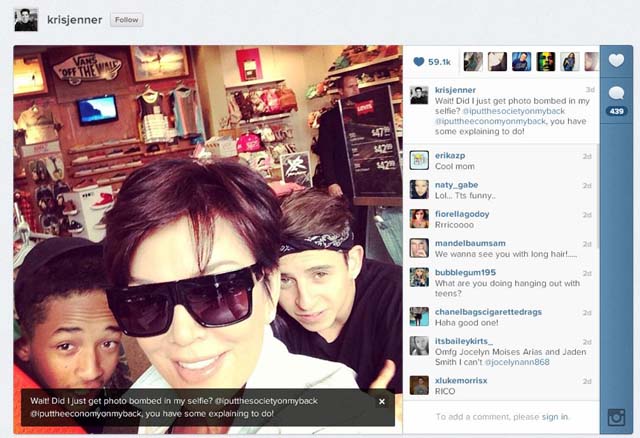
At what (x,y) coordinates should I click in order to perform the action: click on wall. Please return your answer as a coordinate pair (x, y). Image resolution: width=640 pixels, height=438 pixels. Looking at the image, I should click on (121, 123), (299, 72).